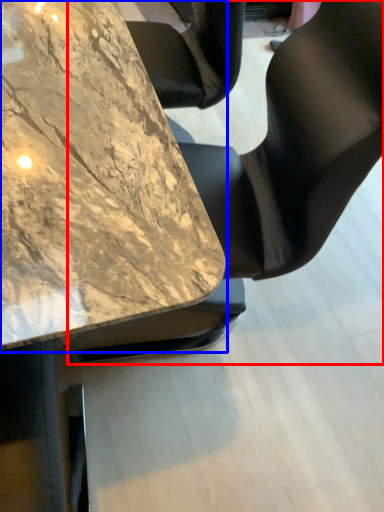
Question: Which point is further to the camera, chair (highlighted by a red box) or table (highlighted by a blue box)?

Choices:
 (A) chair
 (B) table

Answer: (A)